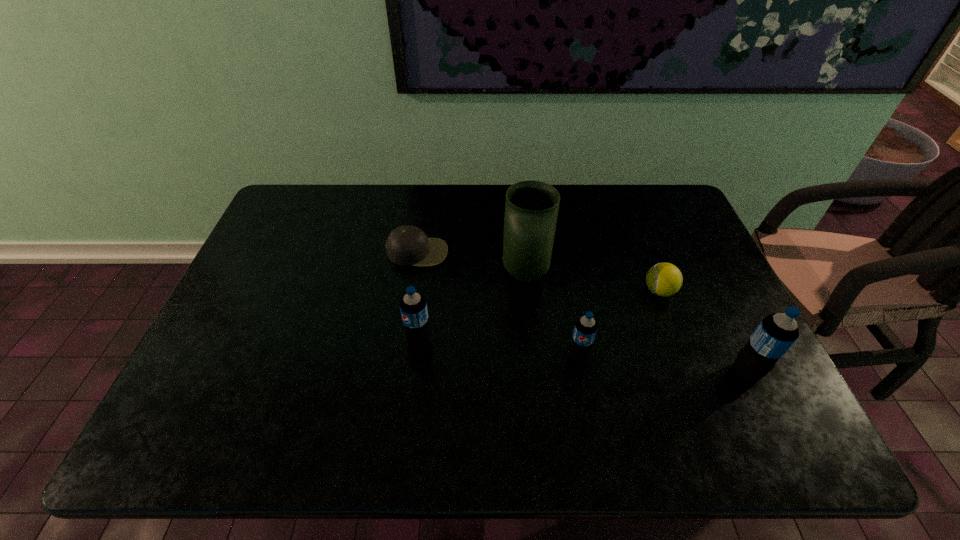
This screenshot has height=540, width=960. What are the coordinates of `vacant area that lies between the fourth shortest object and the third shortest object` in the screenshot? It's located at (498, 348).

The height and width of the screenshot is (540, 960). I want to click on free space between the tallest object and the fifth object from left to right, so click(x=592, y=282).

What are the coordinates of `free space between the vase and the cap` in the screenshot? It's located at (471, 263).

I want to click on vacant space in between the second object from right to left and the third object from right to left, so click(619, 323).

The width and height of the screenshot is (960, 540). In order to click on vacant point located between the fourth tallest object and the leftmost soda bottle in this screenshot , I will do `click(498, 348)`.

You are a GUI agent. You are given a task and a screenshot of the screen. Output one action in this format:
    pyautogui.click(x=<x>, y=<y>)
    Task: Click on the object that is the fifth closest one to the vase
    The image size is (960, 540).
    Given the screenshot: What is the action you would take?
    pyautogui.click(x=776, y=333)

Point out which object is positioned as the fourth nearest to the cap. Please provide its 2D coordinates. Your answer should be formatted as a tuple, i.e. [(x, y)], where the tuple contains the x and y coordinates of a point satisfying the conditions above.

[(663, 279)]

Where is `the closest soda bottle to the rightmost soda bottle`? the closest soda bottle to the rightmost soda bottle is located at coordinates (585, 328).

Identify the location of soda bottle that stands as the closest to the vase. [585, 328].

Identify the location of vacant area that satisfies the following two spatial constraints: 1. on the brim of the cap; 2. on the right side of the second soda bottle from right to left. The image size is (960, 540). (402, 356).